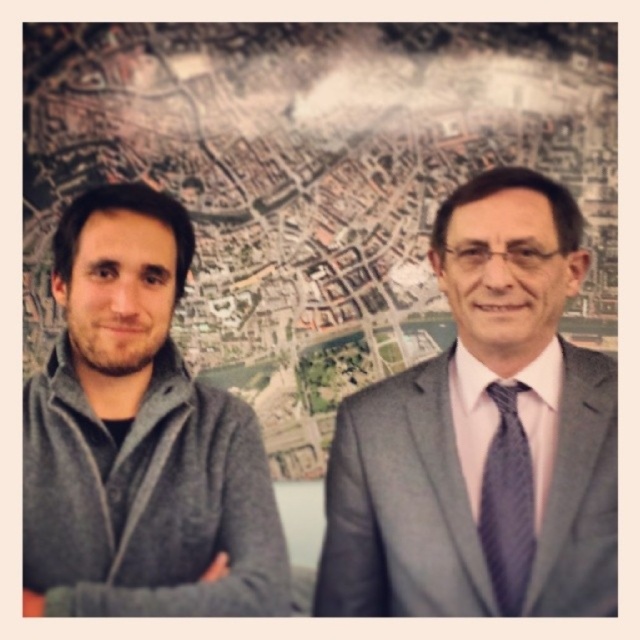
Can you confirm if matte gray suit at right is wider than gray fleece jacket at left?

Correct, the width of matte gray suit at right exceeds that of gray fleece jacket at left.

Who is positioned more to the right, matte gray suit at right or gray fleece jacket at left?

matte gray suit at right is more to the right.

Measure the distance between point (486, 282) and camera.

1.28 meters

Locate an element on the screen. matte gray suit at right is located at coordinates (481, 440).

Which is behind, point (458, 332) or point (528, 544)?

The point (458, 332) is behind.

What do you see at coordinates (481, 440) in the screenshot?
I see `matte gray suit at right` at bounding box center [481, 440].

What do you see at coordinates (481, 440) in the screenshot? I see `matte gray suit at right` at bounding box center [481, 440].

Where is `matte gray suit at right`? matte gray suit at right is located at coordinates [x=481, y=440].

Does gray fleece jacket at left appear under dark gray textured tie at right?

No.

Measure the distance between gray fleece jacket at left and camera.

gray fleece jacket at left is 1.03 meters from camera.

Which is behind, point (97, 305) or point (499, 440)?

The point (499, 440) is more distant.

At what (x,y) coordinates should I click in order to perform the action: click on gray fleece jacket at left. Please return your answer as a coordinate pair (x, y). The image size is (640, 640). Looking at the image, I should click on [138, 438].